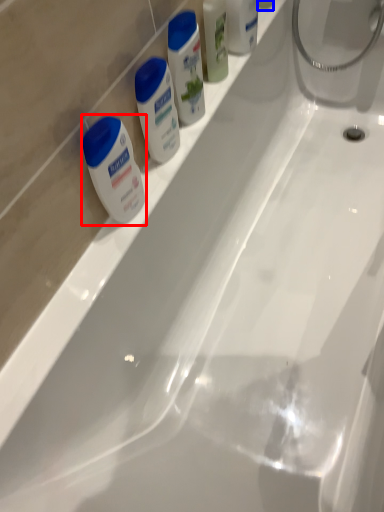
Question: Which point is closer to the camera, shaving cream (highlighted by a red box) or toiletry (highlighted by a blue box)?

Choices:
 (A) shaving cream
 (B) toiletry

Answer: (A)